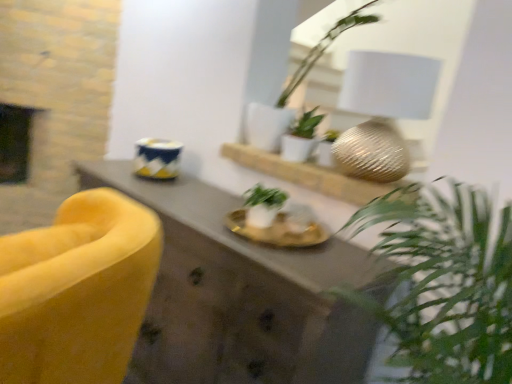
This screenshot has width=512, height=384. I want to click on white ceramic plant at upper center, which is the 1th houseplant from top to bottom, so (x=294, y=89).

Identify the location of black matte fireplace at left. (17, 142).

What is the approximate height of green matte plant at center, marked as the third houseplant in a top-to-bottom arrangement?

It is 5.94 inches.

In order to face textured gold lampshade at upper right, should I rotate leftwards or rightwards?

Turn right approximately 16.358 degrees to face it.

You are a GUI agent. You are given a task and a screenshot of the screen. Output one action in this format:
    pyautogui.click(x=<x>, y=<y>)
    Task: Click on the white ceramic plant at upper center, which appears as the third houseplant when ordered from the bottom
    The height and width of the screenshot is (384, 512).
    Given the screenshot: What is the action you would take?
    pyautogui.click(x=294, y=89)

Who is smaller, green matte plant at center, marked as the third houseplant in a top-to-bottom arrangement, or metallic gold sphere at center?

green matte plant at center, marked as the third houseplant in a top-to-bottom arrangement, is smaller.

From the picture: Is green matte plant at center, arranged as the 1th houseplant when ordered from the bottom, not within metallic gold sphere at center?

Indeed, green matte plant at center, arranged as the 1th houseplant when ordered from the bottom, is completely outside metallic gold sphere at center.

In the scene shown: Is green matte plant at center, marked as the third houseplant in a top-to-bottom arrangement, oriented towards metallic gold sphere at center?

No, green matte plant at center, marked as the third houseplant in a top-to-bottom arrangement, is not aimed at metallic gold sphere at center.

Is green matte plant at center, arranged as the 1th houseplant when ordered from the bottom, far away from metallic gold sphere at center?

No.

Is textured gold lampshade at upper right closer to the viewer compared to green matte plant at center, arranged as the 1th houseplant when ordered from the bottom?

Yes, it is in front of green matte plant at center, arranged as the 1th houseplant when ordered from the bottom.

Can you confirm if textured gold lampshade at upper right is thinner than green matte plant at center, marked as the third houseplant in a top-to-bottom arrangement?

Incorrect, the width of textured gold lampshade at upper right is not less than that of green matte plant at center, marked as the third houseplant in a top-to-bottom arrangement.

Based on the photo, which point is more distant from viewer, (x=374, y=160) or (x=246, y=216)?

The point (x=246, y=216) is farther.

Looking at this image, does metallic gold sphere at center contain velvet yellow armchair at left?

Definitely not — velvet yellow armchair at left is not inside metallic gold sphere at center.

Is metallic gold sphere at center oriented away from velvet yellow armchair at left?

No, metallic gold sphere at center is not facing away from velvet yellow armchair at left.

From a real-world perspective, is metallic gold sphere at center on velvet yellow armchair at left?

Yes.

From the image's perspective, is black matte fireplace at left positioned above or below textured gold lampshade at upper right?

From the image's perspective, black matte fireplace at left appears above textured gold lampshade at upper right.

The image size is (512, 384). Find the location of `fireplace below the textured gold lampshade at upper right (from a real-world perspective)`. fireplace below the textured gold lampshade at upper right (from a real-world perspective) is located at coordinates (17, 142).

Considering the relative positions of black matte fireplace at left and textured gold lampshade at upper right in the image provided, is black matte fireplace at left to the left of textured gold lampshade at upper right from the viewer's perspective?

Indeed, black matte fireplace at left is positioned on the left side of textured gold lampshade at upper right.

Is textured gold lampshade at upper right surrounded by green matte plant at center, arranged as the 1th houseplant when ordered from the bottom?

That's incorrect, textured gold lampshade at upper right is not inside green matte plant at center, arranged as the 1th houseplant when ordered from the bottom.

Is green matte plant at center, arranged as the 1th houseplant when ordered from the bottom, wider than textured gold lampshade at upper right?

No, green matte plant at center, arranged as the 1th houseplant when ordered from the bottom, is not wider than textured gold lampshade at upper right.

From a real-world perspective, which object rests below the other?

In real-world perspective, green matte plant at center, arranged as the 1th houseplant when ordered from the bottom, is lower.

From the image's perspective, is green matte plant at center, marked as the third houseplant in a top-to-bottom arrangement, located beneath textured gold lampshade at upper right?

Indeed, from the image's perspective, green matte plant at center, marked as the third houseplant in a top-to-bottom arrangement, is shown beneath textured gold lampshade at upper right.

From a real-world perspective, which is physically below, green matte plant at center, arranged as the 1th houseplant when ordered from the bottom, or white matte plant at center, the 2th houseplant from the bottom?

green matte plant at center, arranged as the 1th houseplant when ordered from the bottom, from a real-world perspective.

Can you confirm if green matte plant at center, arranged as the 1th houseplant when ordered from the bottom, is wider than white matte plant at center, the 2th houseplant from the bottom?

Yes, green matte plant at center, arranged as the 1th houseplant when ordered from the bottom, is wider than white matte plant at center, the 2th houseplant from the bottom.

Which object is closer to the camera, green matte plant at center, marked as the third houseplant in a top-to-bottom arrangement, or white matte plant at center, placed as the 2th houseplant when sorted from top to bottom?

Positioned in front is green matte plant at center, marked as the third houseplant in a top-to-bottom arrangement.

Are green matte plant at center, marked as the third houseplant in a top-to-bottom arrangement, and white matte plant at center, placed as the 2th houseplant when sorted from top to bottom, located far from each other?

They are positioned close to each other.

Which object is thinner, black matte fireplace at left or white ceramic plant at upper center, which appears as the third houseplant when ordered from the bottom?

With smaller width is white ceramic plant at upper center, which appears as the third houseplant when ordered from the bottom.

From the image's perspective, is black matte fireplace at left below white ceramic plant at upper center, which is the 1th houseplant from top to bottom?

Yes.

Considering the sizes of objects black matte fireplace at left and white ceramic plant at upper center, which is the 1th houseplant from top to bottom, in the image provided, who is taller, black matte fireplace at left or white ceramic plant at upper center, which is the 1th houseplant from top to bottom,?

Standing taller between the two is white ceramic plant at upper center, which is the 1th houseplant from top to bottom.

Would you say black matte fireplace at left contains white ceramic plant at upper center, which appears as the third houseplant when ordered from the bottom?

No, white ceramic plant at upper center, which appears as the third houseplant when ordered from the bottom, is not a part of black matte fireplace at left.

The width and height of the screenshot is (512, 384). Identify the location of houseplant located below the metallic gold sphere at center (from the image's perspective). (263, 205).

At what (x,y) coordinates should I click in order to perform the action: click on table lamp in front of the green matte plant at center, marked as the third houseplant in a top-to-bottom arrangement. Please return your answer as a coordinate pair (x, y). This screenshot has height=384, width=512. Looking at the image, I should click on (382, 111).

Looking at the image, which one is located closer to green matte plant at center, marked as the third houseplant in a top-to-bottom arrangement, textured gold lampshade at upper right or black matte fireplace at left?

textured gold lampshade at upper right lies closer to green matte plant at center, marked as the third houseplant in a top-to-bottom arrangement, than the other object.

Based on their spatial positions, is textured gold lampshade at upper right or black matte fireplace at left further from velvet yellow armchair at left?

black matte fireplace at left.

Looking at the image, which one is located further to black matte fireplace at left, green matte plant at center, marked as the third houseplant in a top-to-bottom arrangement, or velvet yellow armchair at left?

green matte plant at center, marked as the third houseplant in a top-to-bottom arrangement.

From the image, which object appears to be nearer to black matte fireplace at left, white matte plant at center, placed as the 2th houseplant when sorted from top to bottom, or velvet yellow armchair at left?

The object closer to black matte fireplace at left is velvet yellow armchair at left.

Estimate the real-world distances between objects in this image. Which object is closer to white matte plant at center, placed as the 2th houseplant when sorted from top to bottom, textured gold lampshade at upper right or green matte plant at center, arranged as the 1th houseplant when ordered from the bottom?

The object closer to white matte plant at center, placed as the 2th houseplant when sorted from top to bottom, is green matte plant at center, arranged as the 1th houseplant when ordered from the bottom.

Considering their positions, is metallic gold sphere at center positioned further to white matte plant at center, the 2th houseplant from the bottom, than velvet yellow armchair at left?

Based on the image, velvet yellow armchair at left appears to be further to white matte plant at center, the 2th houseplant from the bottom.

Which object lies further to the anchor point velvet yellow armchair at left, white matte plant at center, placed as the 2th houseplant when sorted from top to bottom, or textured gold lampshade at upper right?

white matte plant at center, placed as the 2th houseplant when sorted from top to bottom.

Looking at the image, which one is located further to green matte plant at center, marked as the third houseplant in a top-to-bottom arrangement, black matte fireplace at left or white matte plant at center, the 2th houseplant from the bottom?

black matte fireplace at left lies further to green matte plant at center, marked as the third houseplant in a top-to-bottom arrangement, than the other object.

The height and width of the screenshot is (384, 512). What are the coordinates of `table lamp between white ceramic plant at upper center, which is the 1th houseplant from top to bottom, and velvet yellow armchair at left vertically` in the screenshot? It's located at (382, 111).

I want to click on desk between black matte fireplace at left and textured gold lampshade at upper right in the horizontal direction, so click(x=244, y=296).

Identify the location of desk situated between black matte fireplace at left and white ceramic plant at upper center, which is the 1th houseplant from top to bottom, from left to right. This screenshot has height=384, width=512. tap(244, 296).

You are a GUI agent. You are given a task and a screenshot of the screen. Output one action in this format:
    pyautogui.click(x=<x>, y=<y>)
    Task: Click on the shelf situated between green matte plant at center, arranged as the 1th houseplant when ordered from the bottom, and textured gold lampshade at upper right from left to right
    This screenshot has width=512, height=384.
    Given the screenshot: What is the action you would take?
    pyautogui.click(x=308, y=175)